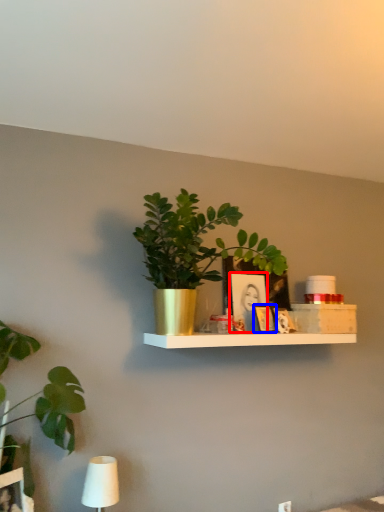
Question: Which of the following is the farthest to the observer, picture frame (highlighted by a red box) or picture frame (highlighted by a blue box)?

Choices:
 (A) picture frame
 (B) picture frame

Answer: (A)